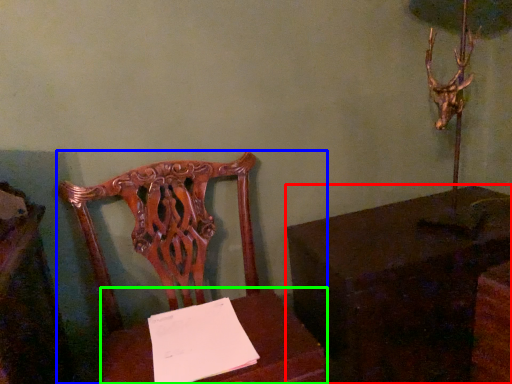
Question: Which object is the farthest from table (highlighted by a red box)? Choose among these: chair (highlighted by a blue box) or table (highlighted by a green box).

Choices:
 (A) chair
 (B) table

Answer: (A)